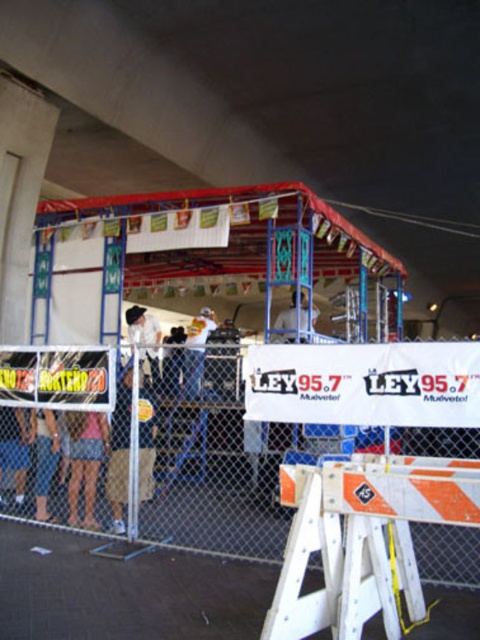
Find the location of a particular element. The height and width of the screenshot is (640, 480). white plastic barricade at lower center is located at coordinates (362, 538).

Does white plastic barricade at lower center appear under pink fabric shorts at lower center?

No, white plastic barricade at lower center is not below pink fabric shorts at lower center.

Where is `white plastic barricade at lower center`? white plastic barricade at lower center is located at coordinates (362, 538).

Between point (447, 376) and point (291, 328), which one is positioned behind?

Point (291, 328)

Does point (476, 536) come behind point (302, 320)?

No, (476, 536) is closer to viewer.

The height and width of the screenshot is (640, 480). I want to click on chain link fence at lower left, so click(x=228, y=467).

Is white plastic barricade at lower center closer to the viewer compared to white fabric at center?

Yes, it is in front of white fabric at center.

Is white plastic barricade at lower center to the right of white fabric at center from the viewer's perspective?

In fact, white plastic barricade at lower center is to the left of white fabric at center.

Where is `white plastic barricade at lower center`? Image resolution: width=480 pixels, height=640 pixels. white plastic barricade at lower center is located at coordinates (362, 538).